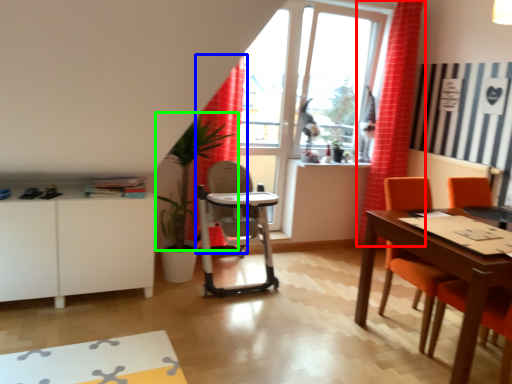
Question: Which is farther away from curtain (highlighted by a red box)? curtain (highlighted by a blue box) or plant (highlighted by a green box)?

Choices:
 (A) curtain
 (B) plant

Answer: (B)